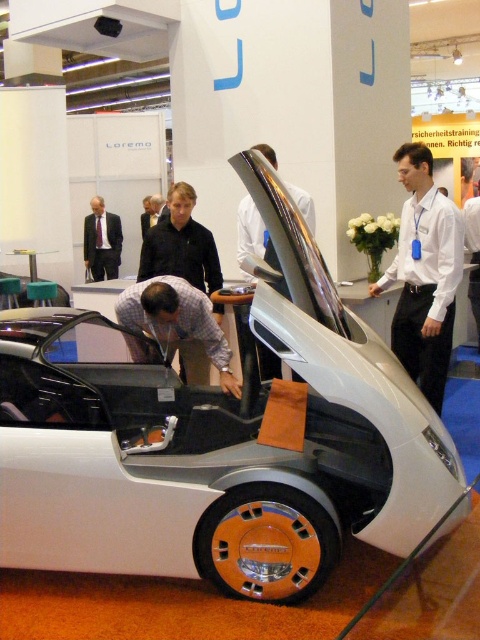
You are standing at the entrance of the exhibition hall and want to locate the matte gray car at center. According to the coordinates provided, is the car positioned closer to the front or the back of the hall?

The matte gray car at center is located at coordinates point [177,321], which places it closer to the front of the hall since the y coordinate is lower, indicating proximity to the entrance.

You are an event organizer at the trade show and need to arrange the white matte car at center and the matte gray car at center side by side in a narrow corridor. Given their widths, which car should be placed first to ensure they both fit without overlapping?

The white matte car at center is wider than the matte gray car at center. To fit both cars side by side in the narrow corridor, you should place the wider white matte car at center first, then the narrower matte gray car at center, ensuring they align properly without overlapping.

You are standing in front of the matte gray car at center and want to touch the glossy metallic car door at center. Which direction should you move to reach it?

Since the matte gray car at center is closer to you than the glossy metallic car door at center, you should move backward to reach the glossy metallic car door at center.